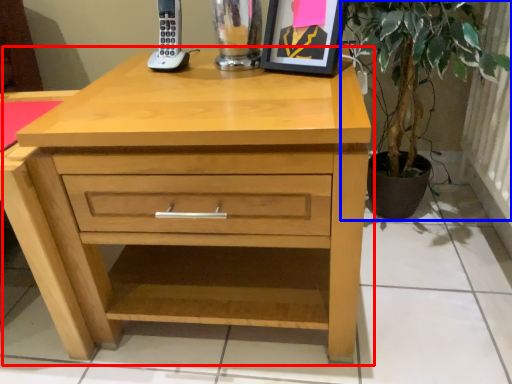
Question: Which point is closer to the camera, chest of drawers (highlighted by a red box) or houseplant (highlighted by a blue box)?

Choices:
 (A) chest of drawers
 (B) houseplant

Answer: (A)